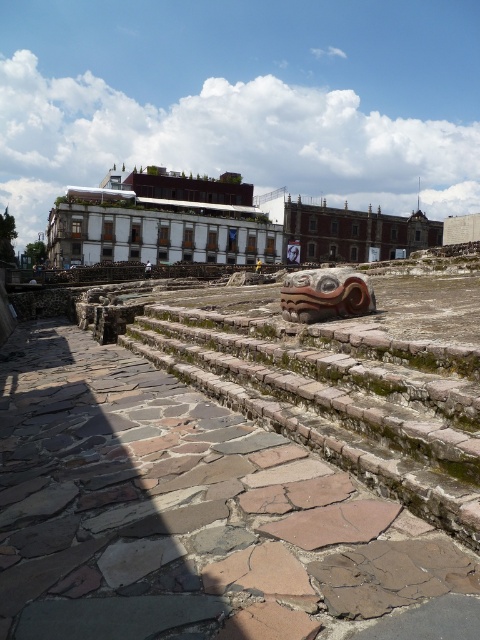
Is rustic stone stairs at center to the left of white stone amphitheater at center from the viewer's perspective?

Yes, rustic stone stairs at center is to the left of white stone amphitheater at center.

Does rustic stone stairs at center have a lesser height compared to white stone amphitheater at center?

Yes, rustic stone stairs at center is shorter than white stone amphitheater at center.

What do you see at coordinates (340, 400) in the screenshot? I see `rustic stone stairs at center` at bounding box center [340, 400].

Where is `rustic stone stairs at center`? This screenshot has width=480, height=640. rustic stone stairs at center is located at coordinates (340, 400).